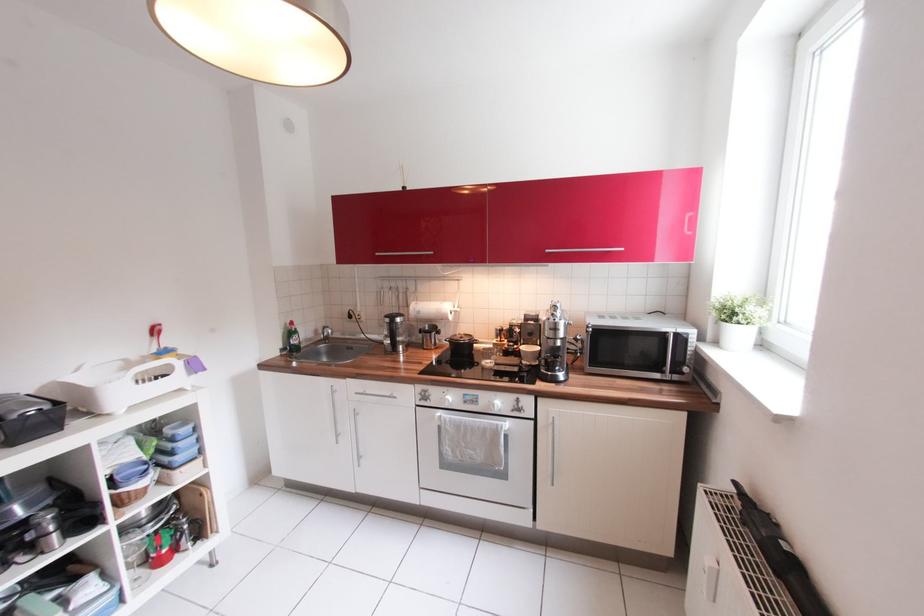
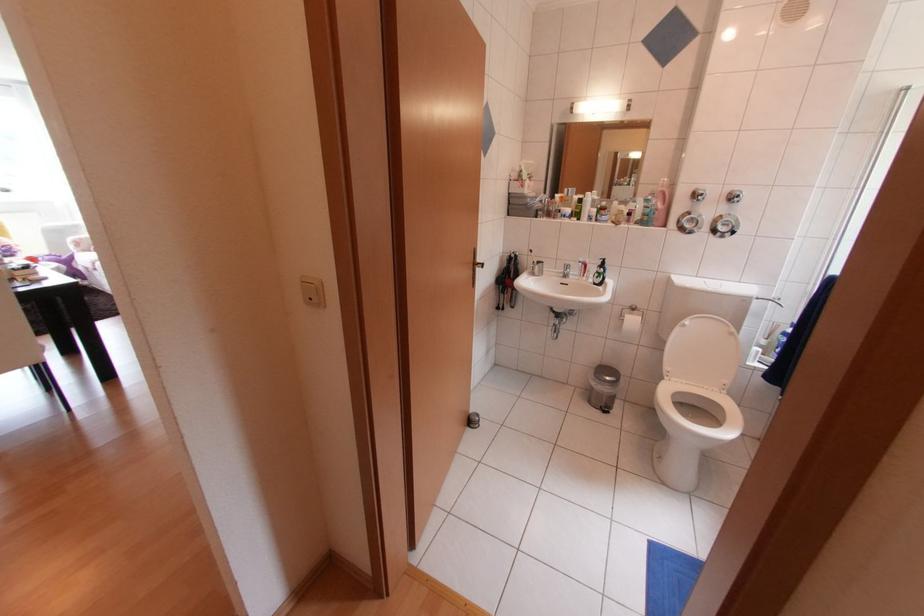
What movement of the cameraman would produce the second image?

The cameraman moved toward left, backward.